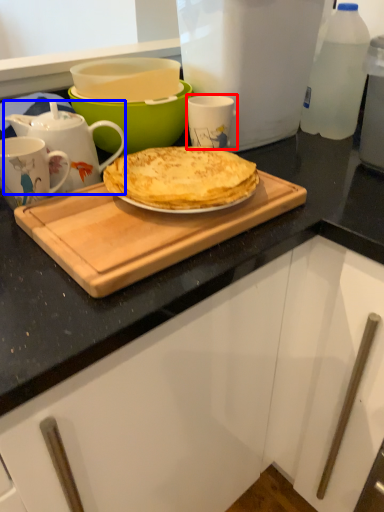
Question: Which point is further to the camera, coffee cup (highlighted by a red box) or teapot (highlighted by a blue box)?

Choices:
 (A) coffee cup
 (B) teapot

Answer: (A)